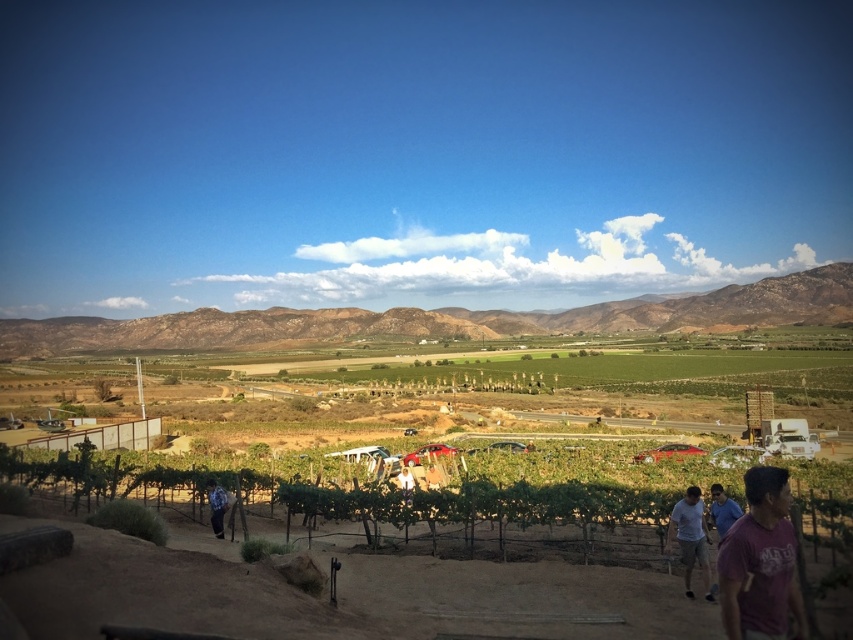
Does green grassy hill at center have a lesser width compared to light blue shirt at lower right?

Incorrect, green grassy hill at center's width is not less than light blue shirt at lower right's.

Is green grassy hill at center positioned behind light blue shirt at lower right?

Yes.

Which is behind, point (73, 317) or point (732, 508)?

Point (73, 317)

This screenshot has height=640, width=853. What are the coordinates of `green grassy hill at center` in the screenshot? It's located at (445, 320).

Is the position of purple cotton shirt at lower right less distant than that of white cotton shirt at lower right?

Yes, purple cotton shirt at lower right is closer to the viewer.

Which is below, purple cotton shirt at lower right or white cotton shirt at lower right?

white cotton shirt at lower right

Is point (776, 536) behind point (686, 554)?

That is False.

Identify the location of purple cotton shirt at lower right. (759, 563).

Is white cotton shirt at lower right shorter than blue denim jeans at lower left?

No.

Who is more distant from viewer, (683, 499) or (218, 529)?

Positioned behind is point (218, 529).

Identify the location of white cotton shirt at lower right. The width and height of the screenshot is (853, 640). (691, 538).

Locate an element on the screen. white cotton shirt at lower right is located at coordinates (691, 538).